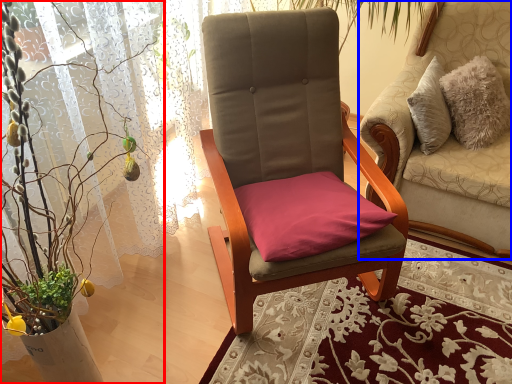
Question: Which object appears farthest to the camera in this image, houseplant (highlighted by a red box) or chair (highlighted by a blue box)?

Choices:
 (A) houseplant
 (B) chair

Answer: (B)